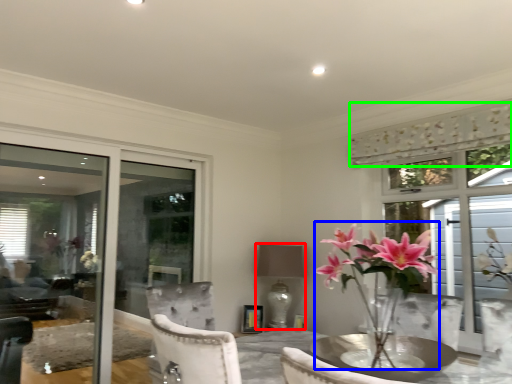
Question: Considering the real-world distances, which object is farthest from lamp (highlighted by a red box)? floral arrangement (highlighted by a blue box) or curtain (highlighted by a green box)?

Choices:
 (A) floral arrangement
 (B) curtain

Answer: (B)